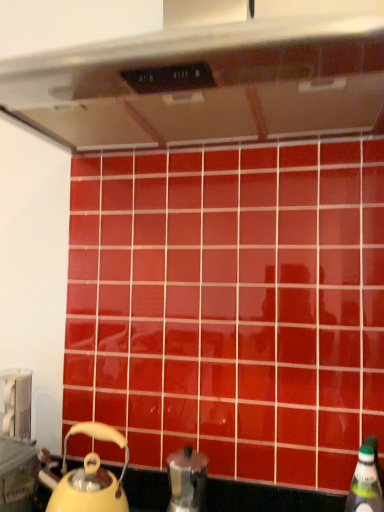
Question: Is metallic silver toaster at lower left not inside metallic silver coffee pot at lower center?

Choices:
 (A) yes
 (B) no

Answer: (A)

Question: Is metallic silver toaster at lower left in contact with metallic silver coffee pot at lower center?

Choices:
 (A) yes
 (B) no

Answer: (B)

Question: Would you say metallic silver toaster at lower left is a long distance from metallic silver coffee pot at lower center?

Choices:
 (A) no
 (B) yes

Answer: (A)

Question: Is metallic silver toaster at lower left positioned with its back to metallic silver coffee pot at lower center?

Choices:
 (A) yes
 (B) no

Answer: (B)

Question: Is metallic silver toaster at lower left in front of metallic silver coffee pot at lower center?

Choices:
 (A) yes
 (B) no

Answer: (B)

Question: From the image's perspective, is metallic silver toaster at lower left on metallic silver coffee pot at lower center?

Choices:
 (A) yes
 (B) no

Answer: (A)

Question: From the image's perspective, is yellow matte kettle at lower left located above metallic silver coffee pot at lower center?

Choices:
 (A) yes
 (B) no

Answer: (A)

Question: Is yellow matte kettle at lower left at the left side of metallic silver coffee pot at lower center?

Choices:
 (A) yes
 (B) no

Answer: (A)

Question: Considering the relative sizes of yellow matte kettle at lower left and metallic silver coffee pot at lower center in the image provided, is yellow matte kettle at lower left taller than metallic silver coffee pot at lower center?

Choices:
 (A) yes
 (B) no

Answer: (A)

Question: Could you tell me if yellow matte kettle at lower left is facing metallic silver coffee pot at lower center?

Choices:
 (A) yes
 (B) no

Answer: (B)

Question: Considering the relative sizes of yellow matte kettle at lower left and metallic silver coffee pot at lower center in the image provided, is yellow matte kettle at lower left bigger than metallic silver coffee pot at lower center?

Choices:
 (A) yes
 (B) no

Answer: (A)

Question: Considering the relative positions of yellow matte kettle at lower left and metallic silver coffee pot at lower center in the image provided, is yellow matte kettle at lower left behind metallic silver coffee pot at lower center?

Choices:
 (A) yes
 (B) no

Answer: (B)

Question: Would you say metallic silver coffee pot at lower center is a long distance from green plastic bottle at lower right?

Choices:
 (A) yes
 (B) no

Answer: (B)